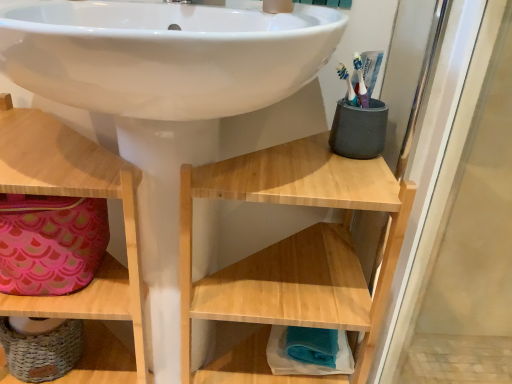
Question: From the image's perspective, is natural wood shelf at center, positioned as the 2th shelf in left-to-right order, above or below pink fabric bag at lower left?

Choices:
 (A) below
 (B) above

Answer: (A)

Question: Is natural wood shelf at center, positioned as the 2th shelf in left-to-right order, wider or thinner than pink fabric bag at lower left?

Choices:
 (A) wide
 (B) thin

Answer: (A)

Question: Estimate the real-world distances between objects in this image. Which object is farther from the teal fabric towel at lower center, which is the 1th shelf in right-to-left order?

Choices:
 (A) pink fabric bag at lower left
 (B) natural wood shelf at center, which ranks as the 2th shelf in right-to-left order
 (C) white glossy sink at center
 (D) wooden shelf at lower left, the third shelf when ordered from right to left

Answer: (C)

Question: Which object is positioned closest to the teal fabric towel at lower center, which is the 1th shelf in right-to-left order?

Choices:
 (A) pink fabric bag at lower left
 (B) natural wood shelf at center, positioned as the 2th shelf in left-to-right order
 (C) white glossy sink at center
 (D) wooden shelf at lower left, marked as the 1th shelf in a left-to-right arrangement

Answer: (B)